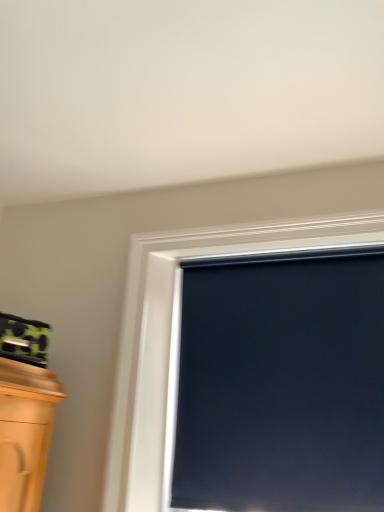
What do you see at coordinates (174, 331) in the screenshot?
I see `matte black window at center` at bounding box center [174, 331].

The image size is (384, 512). Identify the location of matte black window at center. (174, 331).

What are the coordinates of `matte black window at center` in the screenshot? It's located at (174, 331).